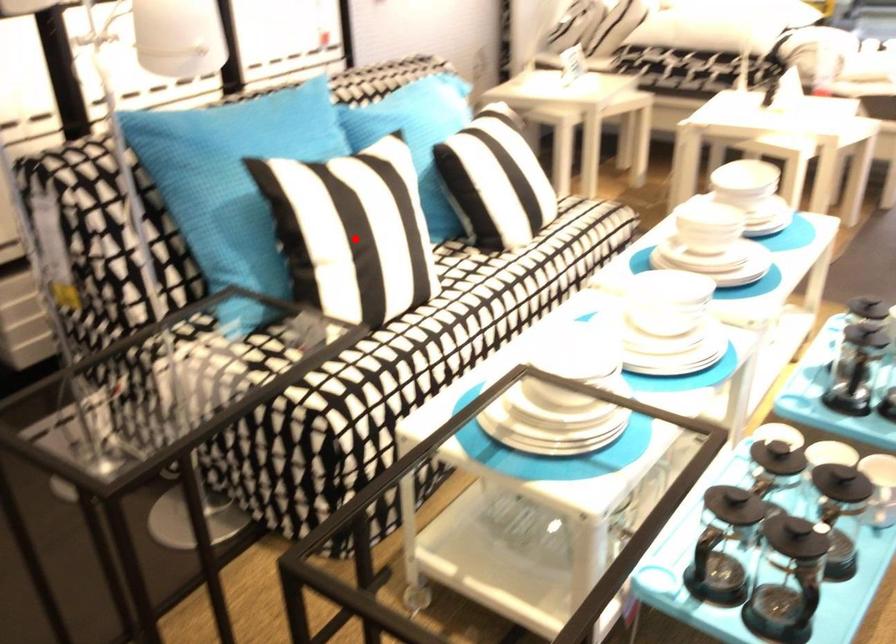
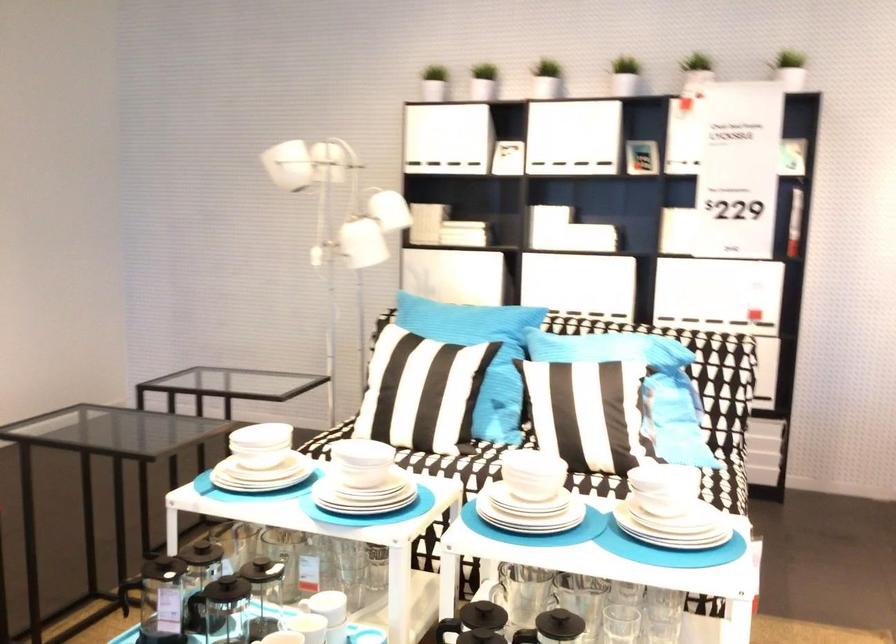
Find the pixel in the second image that matches the highlighted location in the first image.

(398, 377)